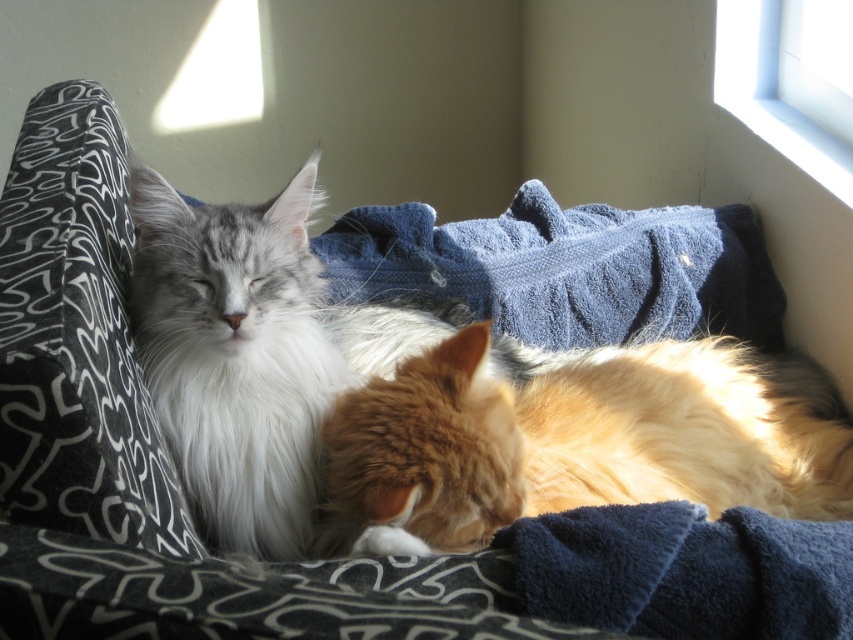
Question: Estimate the real-world distances between objects in this image. Which object is closer to the golden fur cat at center?

Choices:
 (A) silvery-white fluffy cat at left
 (B) transparent glass window at upper right

Answer: (A)

Question: Which object appears closest to the camera in this image?

Choices:
 (A) transparent glass window at upper right
 (B) golden fur cat at center
 (C) blue knitted blanket at center
 (D) silvery-white fluffy cat at left

Answer: (B)

Question: Does blue knitted blanket at center have a greater width compared to transparent glass window at upper right?

Choices:
 (A) no
 (B) yes

Answer: (B)

Question: Which of these objects is positioned farthest from the blue knitted blanket at center?

Choices:
 (A) transparent glass window at upper right
 (B) golden fur cat at center
 (C) silvery-white fluffy cat at left

Answer: (C)

Question: Is blue knitted blanket at center bigger than transparent glass window at upper right?

Choices:
 (A) yes
 (B) no

Answer: (A)

Question: Can you confirm if golden fur cat at center is smaller than blue knitted blanket at center?

Choices:
 (A) yes
 (B) no

Answer: (B)